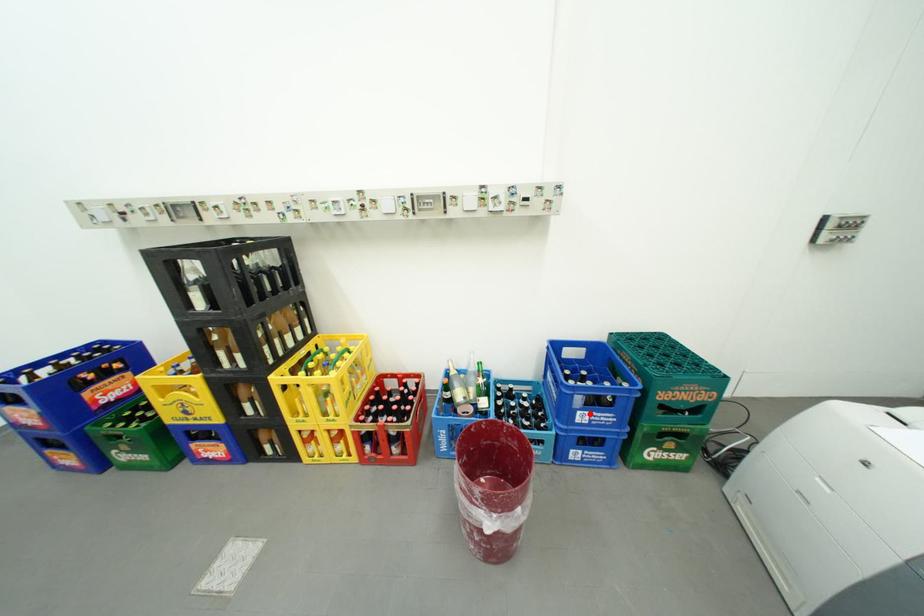
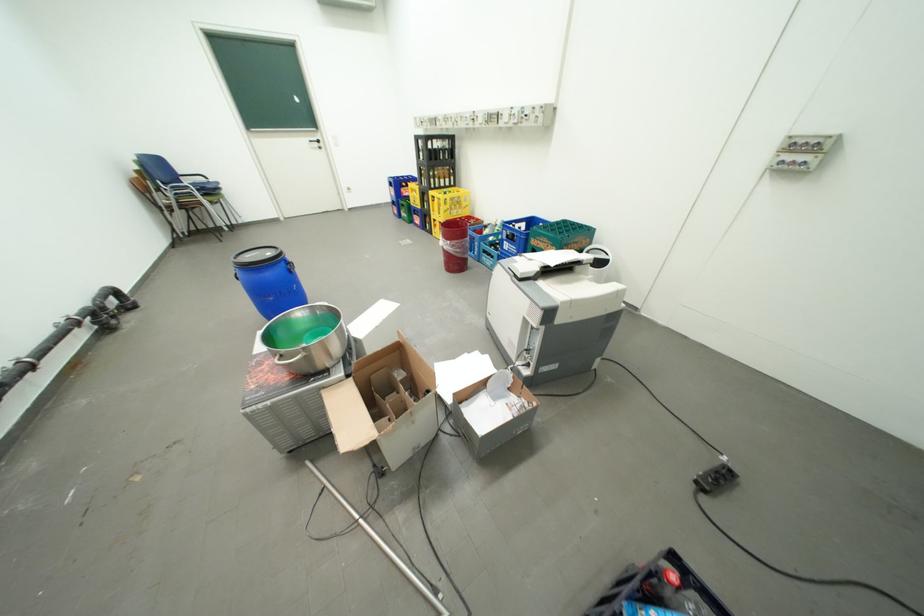
Question: I am providing you with two images of the same scene from different viewpoints. In image1, a red point is highlighted. Considering the same 3D point in image2, which of the following is correct?

Choices:
 (A) It is closer
 (B) It is farther

Answer: (B)